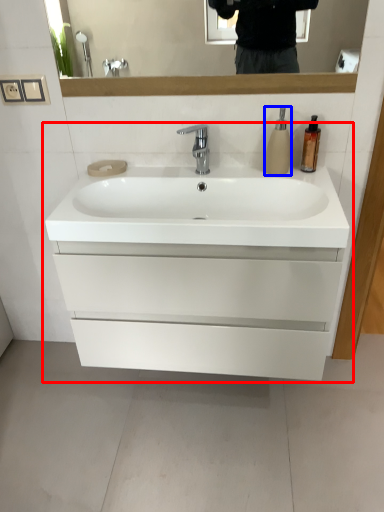
Question: Among these objects, which one is nearest to the camera, bathroom cabinet (highlighted by a red box) or soap dispenser (highlighted by a blue box)?

Choices:
 (A) bathroom cabinet
 (B) soap dispenser

Answer: (A)